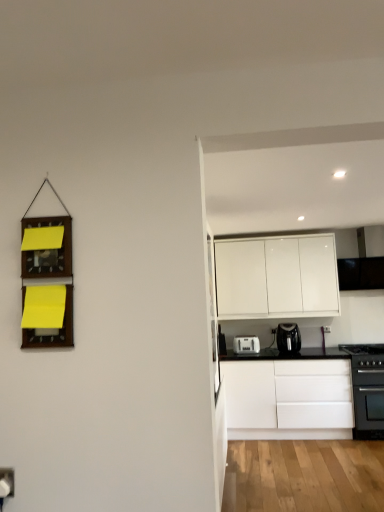
This screenshot has height=512, width=384. I want to click on white glossy cabinet at upper right, the 1th cabinetry from the top, so click(x=277, y=277).

What is the approximate height of black plastic coffee maker at center, positioned as the 1th kitchen appliance in right-to-left order?

black plastic coffee maker at center, positioned as the 1th kitchen appliance in right-to-left order, is 12.67 inches tall.

Where is `white plastic electric outlet at lower left`? white plastic electric outlet at lower left is located at coordinates (6, 482).

This screenshot has width=384, height=512. What do you see at coordinates (6, 482) in the screenshot?
I see `white plastic electric outlet at lower left` at bounding box center [6, 482].

At what (x,y) coordinates should I click in order to perform the action: click on black matte gas stove at right. Please return your answer as a coordinate pair (x, y). This screenshot has height=512, width=384. Looking at the image, I should click on (365, 354).

You are a GUI agent. You are given a task and a screenshot of the screen. Output one action in this format:
    pyautogui.click(x=<x>, y=<y>)
    Task: Click on the white plastic toaster at lower center, the 1th kitchen appliance from the left
    
    Given the screenshot: What is the action you would take?
    pyautogui.click(x=246, y=345)

Measure the distance between black matte oven at lower right and camera.

14.58 feet.

Image resolution: width=384 pixels, height=512 pixels. Identify the location of white matte cabinet at right, placed as the 2th cabinetry when sorted from top to bottom. (288, 399).

At what (x,y) coordinates should I click in order to perform the action: click on white glossy cabinet at upper right, which appears as the 2th cabinetry when ordered from the bottom. Please return your answer as a coordinate pair (x, y). This screenshot has height=512, width=384. Looking at the image, I should click on (277, 277).

Locate an element on the screen. shelf located in front of the white plastic toaster at lower center, the 1th kitchen appliance from the left is located at coordinates (47, 285).

Would you say wooden memo board at left contains white plastic toaster at lower center, the 1th kitchen appliance from the left?

No, white plastic toaster at lower center, the 1th kitchen appliance from the left, is not inside wooden memo board at left.

Is wooden memo board at left facing away from white plastic toaster at lower center, the 2th kitchen appliance in the right-to-left sequence?

Yes, wooden memo board at left is facing away from white plastic toaster at lower center, the 2th kitchen appliance in the right-to-left sequence.

From a real-world perspective, is white matte cabinet at right, placed as the 2th cabinetry when sorted from top to bottom, physically located above or below white plastic toaster at lower center, the 1th kitchen appliance from the left?

white matte cabinet at right, placed as the 2th cabinetry when sorted from top to bottom, is situated lower than white plastic toaster at lower center, the 1th kitchen appliance from the left, in the real world.

Are white matte cabinet at right, placed as the 2th cabinetry when sorted from top to bottom, and white plastic toaster at lower center, the 1th kitchen appliance from the left, far apart?

No.

Between point (302, 404) and point (259, 342), which one is positioned behind?

The point (259, 342) is farther from the camera.

What's the angular difference between white matte cabinet at right, placed as the 2th cabinetry when sorted from top to bottom, and white plastic toaster at lower center, the 2th kitchen appliance in the right-to-left sequence,'s facing directions?

The facing directions of white matte cabinet at right, placed as the 2th cabinetry when sorted from top to bottom, and white plastic toaster at lower center, the 2th kitchen appliance in the right-to-left sequence, are 0.407 degrees apart.

Identify the location of the 2nd cabinetry behind when counting from the white plastic electric outlet at lower left. (277, 277).

Does white glossy cabinet at upper right, which appears as the 2th cabinetry when ordered from the bottom, contain white plastic electric outlet at lower left?

Definitely not — white plastic electric outlet at lower left is not inside white glossy cabinet at upper right, which appears as the 2th cabinetry when ordered from the bottom.

Is white glossy cabinet at upper right, which appears as the 2th cabinetry when ordered from the bottom, thinner than white plastic electric outlet at lower left?

No.

What's the angular difference between white matte cabinet at right, placed as the 2th cabinetry when sorted from top to bottom, and wooden memo board at left's facing directions?

They differ by 0.0762 degrees in their facing directions.

Is white matte cabinet at right, placed as the 2th cabinetry when sorted from top to bottom, next to wooden memo board at left and touching it?

No, white matte cabinet at right, placed as the 2th cabinetry when sorted from top to bottom, is not with wooden memo board at left.

From the image's perspective, between white matte cabinet at right, placed as the 2th cabinetry when sorted from top to bottom, and wooden memo board at left, who is located below?

white matte cabinet at right, placed as the 2th cabinetry when sorted from top to bottom, is shown below in the image.

Is black matte oven at lower right placed right next to wooden memo board at left?

No, black matte oven at lower right is not making contact with wooden memo board at left.

Is black matte oven at lower right smaller than wooden memo board at left?

No.

Considering the relative sizes of black matte oven at lower right and wooden memo board at left in the image provided, is black matte oven at lower right taller than wooden memo board at left?

Yes, black matte oven at lower right is taller than wooden memo board at left.

Is wooden memo board at left inside black matte oven at lower right?

Definitely not — wooden memo board at left is not inside black matte oven at lower right.

Identify the location of kitchen appliance that is the 1st object located above the white matte cabinet at right, placed as the 2th cabinetry when sorted from top to bottom (from the image's perspective). This screenshot has height=512, width=384. (246, 345).

Considering their positions, is white plastic toaster at lower center, the 2th kitchen appliance in the right-to-left sequence, located in front of or behind white matte cabinet at right, placed as the 2th cabinetry when sorted from top to bottom?

white plastic toaster at lower center, the 2th kitchen appliance in the right-to-left sequence, is positioned farther from the viewer than white matte cabinet at right, placed as the 2th cabinetry when sorted from top to bottom.

From a real-world perspective, between white plastic toaster at lower center, the 2th kitchen appliance in the right-to-left sequence, and white matte cabinet at right, placed as the 2th cabinetry when sorted from top to bottom, who is vertically higher?

From a 3D spatial view, white plastic toaster at lower center, the 2th kitchen appliance in the right-to-left sequence, is above.

From the image's perspective, between white plastic toaster at lower center, the 2th kitchen appliance in the right-to-left sequence, and white matte cabinet at right, the 1th cabinetry ordered from the bottom, who is located below?

From the image's view, white matte cabinet at right, the 1th cabinetry ordered from the bottom, is below.

Are white plastic electric outlet at lower left and black matte oven at lower right far apart?

Yes, white plastic electric outlet at lower left and black matte oven at lower right are located far from each other.

Does white plastic electric outlet at lower left appear on the right side of black matte oven at lower right?

No, white plastic electric outlet at lower left is not to the right of black matte oven at lower right.

Is point (7, 471) closer or farther from the camera than point (360, 419)?

Point (7, 471) is positioned closer to the camera compared to point (360, 419).

This screenshot has width=384, height=512. What are the coordinates of `shelf above the white plastic toaster at lower center, the 2th kitchen appliance in the right-to-left sequence (from the image's perspective)` in the screenshot? It's located at (47, 285).

Locate an element on the screen. the 2nd kitchen appliance behind when counting from the white matte cabinet at right, the 1th cabinetry ordered from the bottom is located at coordinates (246, 345).

From the image, which object appears to be farther from white matte cabinet at right, the 1th cabinetry ordered from the bottom, black plastic coffee maker at center, the second kitchen appliance in the left-to-right sequence, or black matte oven at lower right?

black plastic coffee maker at center, the second kitchen appliance in the left-to-right sequence, lies further to white matte cabinet at right, the 1th cabinetry ordered from the bottom, than the other object.

When comparing their distances from white glossy cabinet at upper right, the 1th cabinetry from the top, does wooden memo board at left or black matte gas stove at right seem further?

Based on the image, wooden memo board at left appears to be further to white glossy cabinet at upper right, the 1th cabinetry from the top.

From the picture: Estimate the real-world distances between objects in this image. Which object is closer to black matte oven at lower right, white matte cabinet at right, the 1th cabinetry ordered from the bottom, or white glossy cabinet at upper right, the 1th cabinetry from the top?

white matte cabinet at right, the 1th cabinetry ordered from the bottom, is positioned closer to the anchor black matte oven at lower right.

Looking at the image, which one is located closer to white plastic toaster at lower center, the 2th kitchen appliance in the right-to-left sequence, white matte cabinet at right, the 1th cabinetry ordered from the bottom, or black plastic coffee maker at center, the second kitchen appliance in the left-to-right sequence?

black plastic coffee maker at center, the second kitchen appliance in the left-to-right sequence, lies closer to white plastic toaster at lower center, the 2th kitchen appliance in the right-to-left sequence, than the other object.

Considering their positions, is white glossy cabinet at upper right, which appears as the 2th cabinetry when ordered from the bottom, positioned further to white matte cabinet at right, placed as the 2th cabinetry when sorted from top to bottom, than black matte oven at lower right?

Among the two, white glossy cabinet at upper right, which appears as the 2th cabinetry when ordered from the bottom, is located further to white matte cabinet at right, placed as the 2th cabinetry when sorted from top to bottom.

From the image, which object appears to be nearer to black matte oven at lower right, white plastic toaster at lower center, the 2th kitchen appliance in the right-to-left sequence, or black plastic coffee maker at center, the second kitchen appliance in the left-to-right sequence?

The object closer to black matte oven at lower right is black plastic coffee maker at center, the second kitchen appliance in the left-to-right sequence.

Considering their positions, is white plastic electric outlet at lower left positioned closer to black matte oven at lower right than black matte gas stove at right?

Based on the image, black matte gas stove at right appears to be nearer to black matte oven at lower right.

Which object lies nearer to the anchor point white plastic electric outlet at lower left, black matte gas stove at right or white plastic toaster at lower center, the 2th kitchen appliance in the right-to-left sequence?

Based on the image, white plastic toaster at lower center, the 2th kitchen appliance in the right-to-left sequence, appears to be nearer to white plastic electric outlet at lower left.

Locate an element on the screen. The height and width of the screenshot is (512, 384). gas stove between white plastic electric outlet at lower left and white glossy cabinet at upper right, which appears as the 2th cabinetry when ordered from the bottom, from front to back is located at coordinates (365, 354).

Locate an element on the screen. The image size is (384, 512). home appliance between white plastic electric outlet at lower left and black matte gas stove at right in the front-back direction is located at coordinates (367, 389).

Locate an element on the screen. The width and height of the screenshot is (384, 512). electric outlet located between wooden memo board at left and white matte cabinet at right, the 1th cabinetry ordered from the bottom, in the depth direction is located at coordinates click(x=6, y=482).

Where is `gas stove between white plastic toaster at lower center, the 2th kitchen appliance in the right-to-left sequence, and black matte oven at lower right from left to right`? The image size is (384, 512). gas stove between white plastic toaster at lower center, the 2th kitchen appliance in the right-to-left sequence, and black matte oven at lower right from left to right is located at coordinates (365, 354).